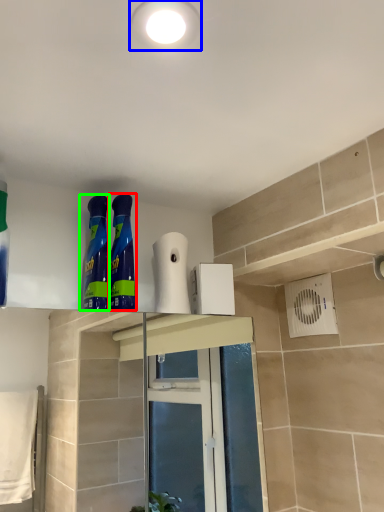
Question: Which is nearer to the cleaning product (highlighted by a red box)? lighting (highlighted by a blue box) or cleaning product (highlighted by a green box).

Choices:
 (A) lighting
 (B) cleaning product

Answer: (B)